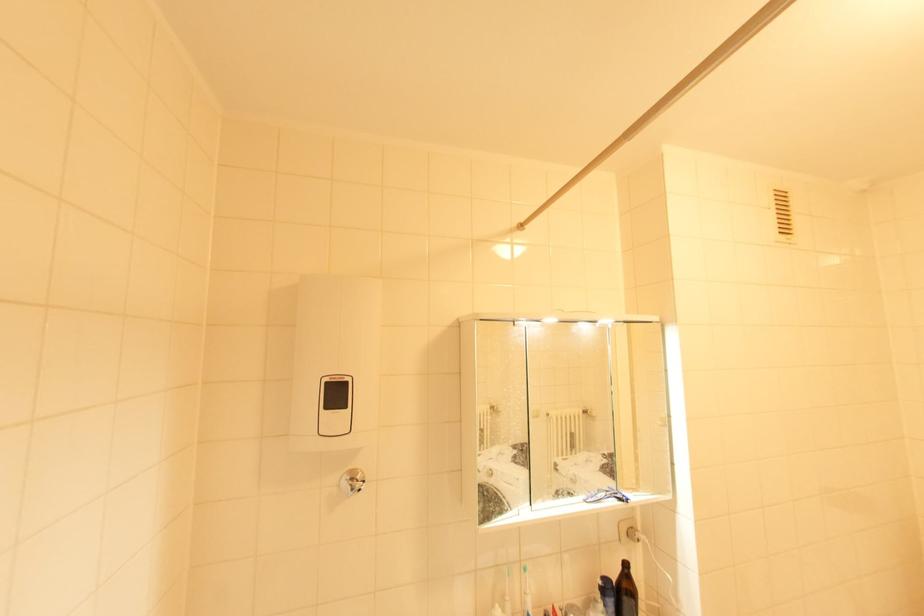
Locate an element on the screen. This screenshot has width=924, height=616. chrome valve handle is located at coordinates (351, 482).